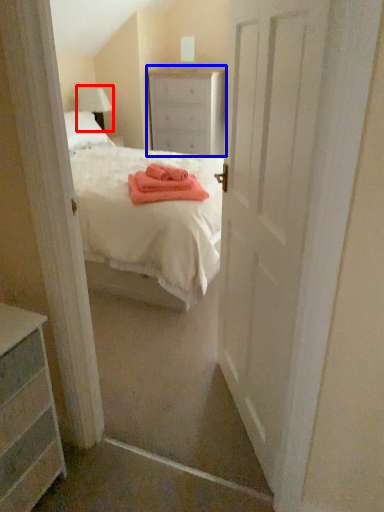
Question: Which object is further to the camera taking this photo, lamp (highlighted by a red box) or nightstand (highlighted by a blue box)?

Choices:
 (A) lamp
 (B) nightstand

Answer: (B)